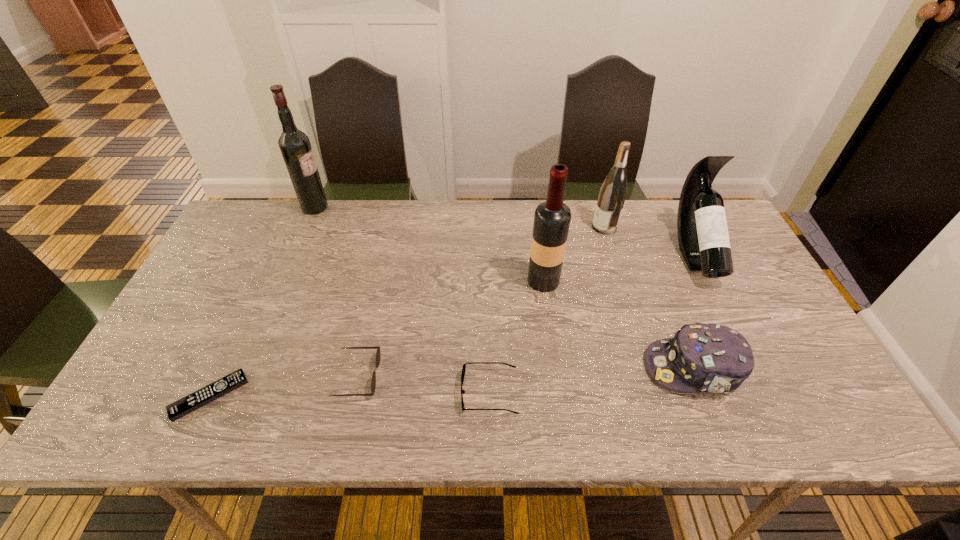
This screenshot has width=960, height=540. Find the location of `free space between the rightmost wine bottle and the third wine bottle from right to left`. free space between the rightmost wine bottle and the third wine bottle from right to left is located at coordinates (619, 267).

Image resolution: width=960 pixels, height=540 pixels. Find the location of `vacant space that's between the farthest wine bottle and the second wine bottle from right to left`. vacant space that's between the farthest wine bottle and the second wine bottle from right to left is located at coordinates (460, 217).

This screenshot has width=960, height=540. Identify the location of free space between the fourth object from left to right and the headwear. (591, 380).

Where is `vacant area that lies between the leftmost wine bottle and the fifth object from right to left`? vacant area that lies between the leftmost wine bottle and the fifth object from right to left is located at coordinates pos(402,300).

What are the coordinates of `free spot between the sunglasses and the leftmost wine bottle` in the screenshot? It's located at (336, 292).

The height and width of the screenshot is (540, 960). I want to click on empty space that is in between the third shortest object and the third wine bottle from right to left, so click(x=450, y=328).

The width and height of the screenshot is (960, 540). I want to click on vacant area that lies between the rightmost wine bottle and the third wine bottle from right to left, so click(619, 267).

The image size is (960, 540). I want to click on object that is the second nearest to the leftmost wine bottle, so click(x=176, y=410).

Identify which object is the second closest to the fourth shortest object. Please provide its 2D coordinates. Your answer should be formatted as a tuple, i.e. [(x, y)], where the tuple contains the x and y coordinates of a point satisfying the conditions above.

[(552, 218)]

Identify which wine bottle is the fourth nearest to the third object from left to right. Please provide its 2D coordinates. Your answer should be formatted as a tuple, i.e. [(x, y)], where the tuple contains the x and y coordinates of a point satisfying the conditions above.

[(703, 237)]